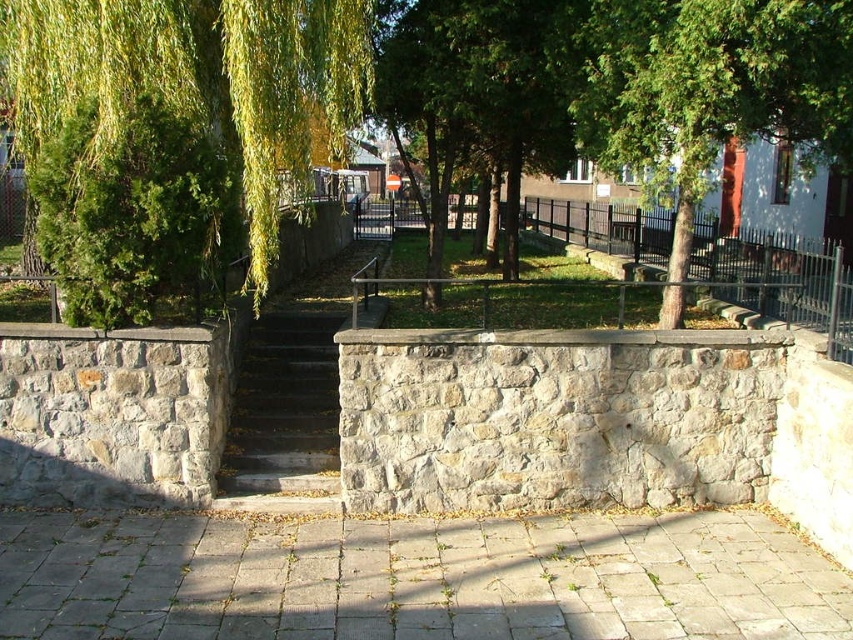
Question: Can you confirm if green leafy willow at left is positioned to the left of dark gray stone stairs at center?

Choices:
 (A) no
 (B) yes

Answer: (B)

Question: Is green leafy willow at left positioned at the back of dark gray stone stairs at center?

Choices:
 (A) no
 (B) yes

Answer: (A)

Question: Is green leafy willow at left thinner than dark gray stone stairs at center?

Choices:
 (A) yes
 (B) no

Answer: (B)

Question: Which object appears farthest from the camera in this image?

Choices:
 (A) green leafy willow at left
 (B) dark gray stone stairs at center

Answer: (B)